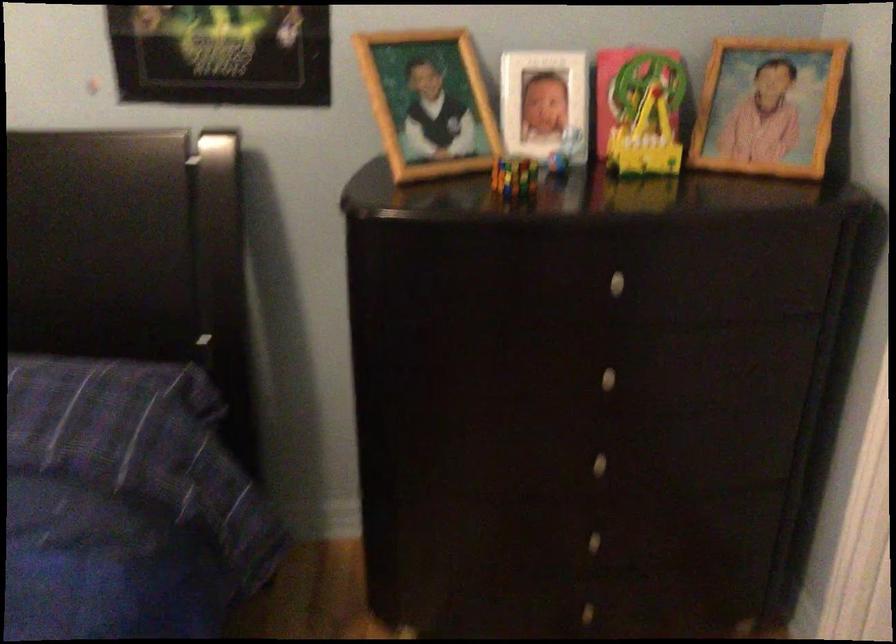
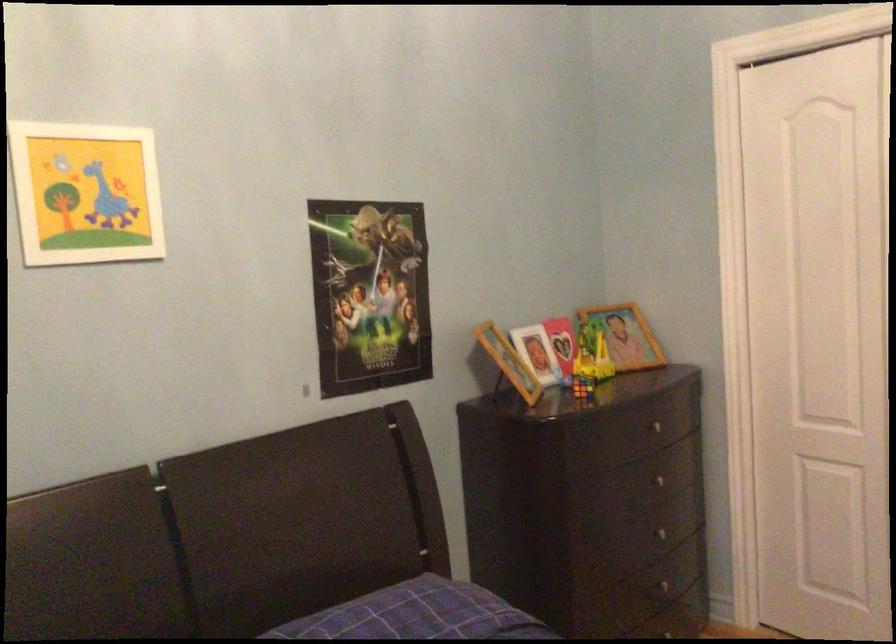
Locate, in the second image, the point that corresponds to point (597, 451) in the first image.

(667, 532)